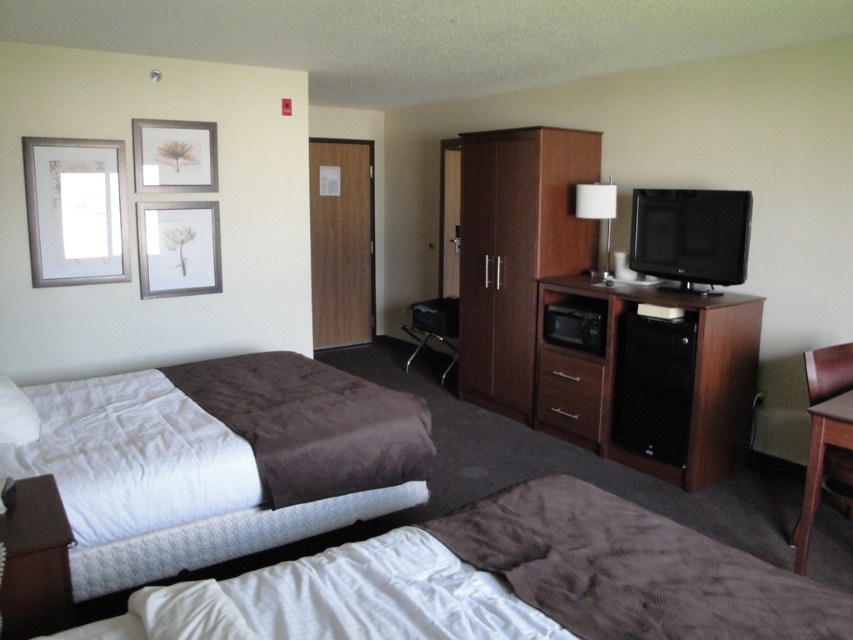
Is point (672, 448) positioned before point (824, 436)?

That is False.

Can you confirm if brown wood dresser at center right is positioned to the left of brown wood armchair at lower right?

Yes, brown wood dresser at center right is to the left of brown wood armchair at lower right.

Find the location of a particular element. This screenshot has height=640, width=853. brown wood dresser at center right is located at coordinates (653, 380).

Does brown wood dresser at center right appear on the right side of brown leather table at lower left?

Indeed, brown wood dresser at center right is positioned on the right side of brown leather table at lower left.

Who is higher up, brown wood dresser at center right or brown leather table at lower left?

brown wood dresser at center right is higher up.

The image size is (853, 640). What do you see at coordinates (653, 380) in the screenshot?
I see `brown wood dresser at center right` at bounding box center [653, 380].

You are a GUI agent. You are given a task and a screenshot of the screen. Output one action in this format:
    pyautogui.click(x=<x>, y=<y>)
    Task: Click on the brown wood dresser at center right
    The width and height of the screenshot is (853, 640).
    Given the screenshot: What is the action you would take?
    pyautogui.click(x=653, y=380)

Between brown wood armchair at lower right and matte silver picture frame at upper left, which one is positioned lower?

brown wood armchair at lower right

In order to click on brown wood armchair at lower right in this screenshot , I will do `click(827, 436)`.